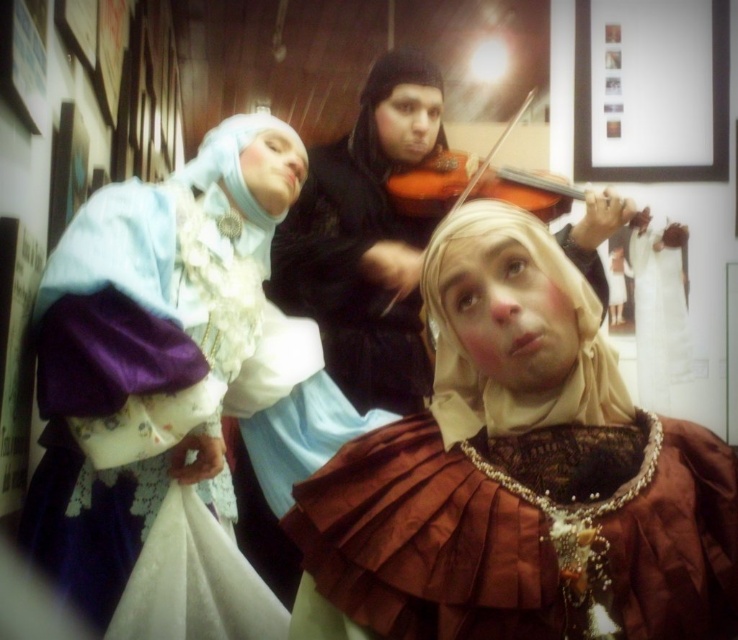
Question: Which of the following is the closest to the observer?

Choices:
 (A) brown satin dress at center
 (B) matte blue fabric dress at left
 (C) wooden violin at center
 (D) silky white gown at center

Answer: (A)

Question: Does brown satin dress at center appear under wooden violin at center?

Choices:
 (A) yes
 (B) no

Answer: (A)

Question: Is brown satin dress at center further to the viewer compared to silky white gown at center?

Choices:
 (A) no
 (B) yes

Answer: (A)

Question: Which of the following is the closest to the observer?

Choices:
 (A) (665, 292)
 (B) (117, 540)
 (C) (527, 100)

Answer: (B)

Question: Where is matte blue fabric dress at left located in relation to wooden violin at center in the image?

Choices:
 (A) right
 (B) left

Answer: (B)

Question: Based on their relative distances, which object is nearer to the matte blue fabric dress at left?

Choices:
 (A) brown satin dress at center
 (B) silky white gown at center

Answer: (A)